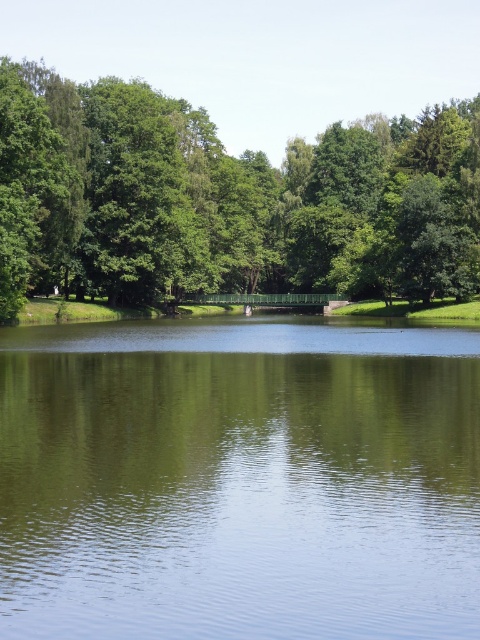
Question: Which point is closer to the camera?

Choices:
 (A) green reflective water at center
 (B) green leafy tree at upper left

Answer: (A)

Question: Can you confirm if green reflective water at center is smaller than green leafy tree at upper left?

Choices:
 (A) no
 (B) yes

Answer: (B)

Question: Among these objects, which one is farthest from the camera?

Choices:
 (A) green reflective water at center
 (B) green leafy tree at upper left

Answer: (B)

Question: Is green reflective water at center wider than green leafy tree at upper left?

Choices:
 (A) yes
 (B) no

Answer: (B)

Question: Does green reflective water at center appear on the left side of green leafy tree at upper left?

Choices:
 (A) yes
 (B) no

Answer: (A)

Question: Which of the following is the farthest from the observer?

Choices:
 (A) (408, 477)
 (B) (297, 168)

Answer: (B)